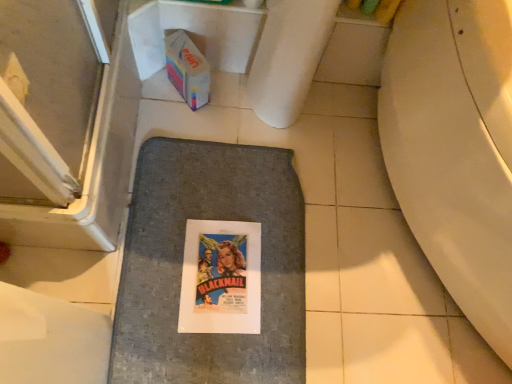
Find the location of a particular element. free space behind gray fabric bath mat at center is located at coordinates (275, 141).